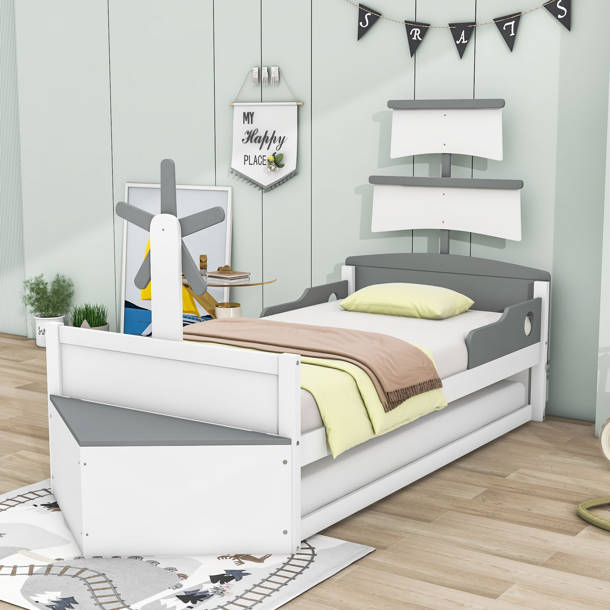
Where is `pillow`? pillow is located at coordinates (393, 293).